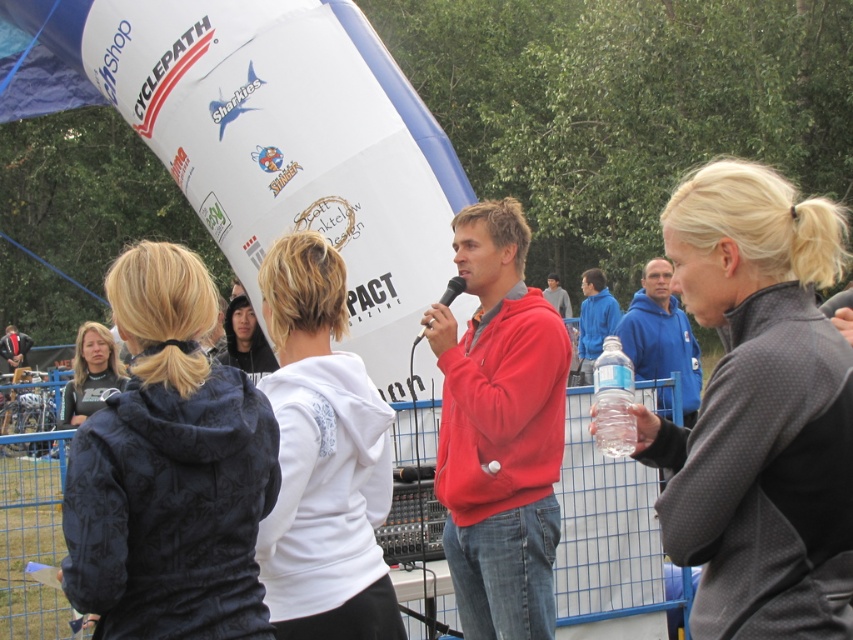
Between matte black jacket at lower left and black plastic microphone at center, which one appears on the left side from the viewer's perspective?

matte black jacket at lower left is more to the left.

Who is more distant from viewer, (83, 365) or (450, 291)?

Positioned behind is point (83, 365).

This screenshot has width=853, height=640. Find the location of `matte black jacket at lower left`. matte black jacket at lower left is located at coordinates (90, 372).

Which is behind, point (825, 435) or point (91, 321)?

The point (91, 321) is more distant.

Is point (695, 173) less distant than point (67, 388)?

No, (695, 173) is further to viewer.

Which is behind, point (679, 262) or point (96, 396)?

The point (96, 396) is behind.

The height and width of the screenshot is (640, 853). I want to click on dark gray fleece jacket at right, so click(759, 410).

Does dark blue quilted jacket at center appear over white fleece jacket at center?

Correct, dark blue quilted jacket at center is located above white fleece jacket at center.

What do you see at coordinates (169, 470) in the screenshot? I see `dark blue quilted jacket at center` at bounding box center [169, 470].

Which is in front, point (142, 364) or point (331, 371)?

Point (142, 364)

Identify the location of dark blue quilted jacket at center. The image size is (853, 640). (169, 470).